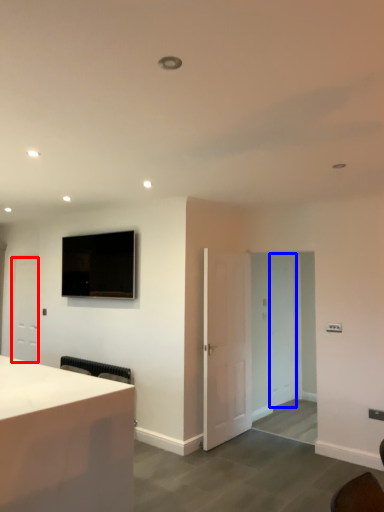
Question: Which object appears farthest to the camera in this image, door (highlighted by a red box) or glass door (highlighted by a blue box)?

Choices:
 (A) door
 (B) glass door

Answer: (A)